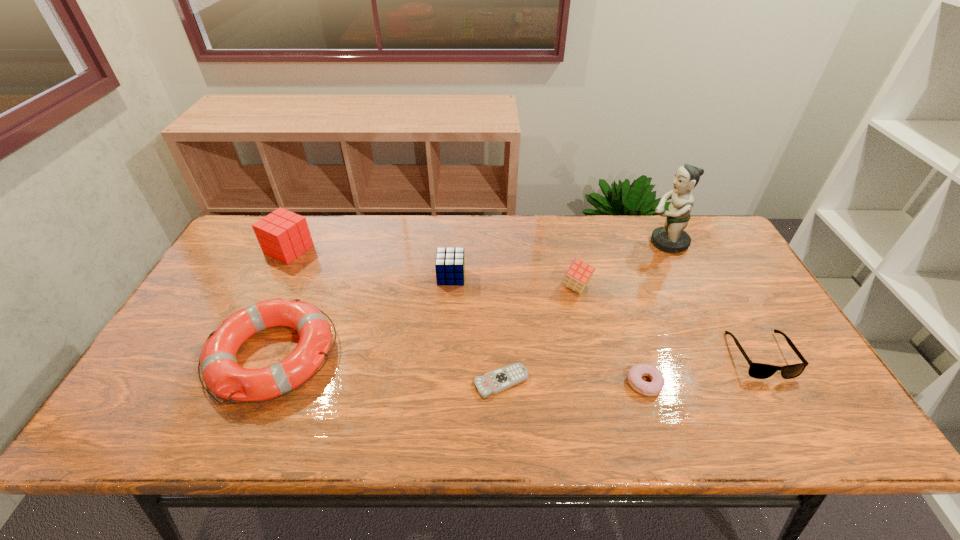
The image size is (960, 540). Identify the location of vacant space that is in between the second cube from right to left and the tallest object. (559, 260).

Locate an element on the screen. This screenshot has width=960, height=540. vacant region between the life buoy and the figurine is located at coordinates (469, 299).

Identify the location of free space between the seventh shortest object and the sunglasses. (524, 302).

Locate an element on the screen. The image size is (960, 540). blank region between the second tallest object and the seventh tallest object is located at coordinates click(x=467, y=316).

You are a GUI agent. You are given a task and a screenshot of the screen. Output one action in this format:
    pyautogui.click(x=<x>, y=<y>)
    Task: Click on the vacant area between the farthest cube and the sunglasses
    The image size is (960, 540).
    Given the screenshot: What is the action you would take?
    pyautogui.click(x=524, y=302)

This screenshot has width=960, height=540. What are the coordinates of `free area in between the figurine and the seventh shortest object` in the screenshot? It's located at (478, 246).

Locate an element on the screen. The height and width of the screenshot is (540, 960). free point between the sunglasses and the life buoy is located at coordinates (516, 355).

At what (x,y) coordinates should I click in order to perform the action: click on free space that is in between the sunglasses and the rightmost cube. Please return your answer as a coordinate pair (x, y). Looking at the image, I should click on (668, 321).

Identify which object is located as the nearest to the seventh tallest object. Please provide its 2D coordinates. Your answer should be formatted as a tuple, i.e. [(x, y)], where the tuple contains the x and y coordinates of a point satisfying the conditions above.

[(756, 370)]

Locate an element on the screen. The image size is (960, 540). object that stands as the sixth closest to the life buoy is located at coordinates (672, 238).